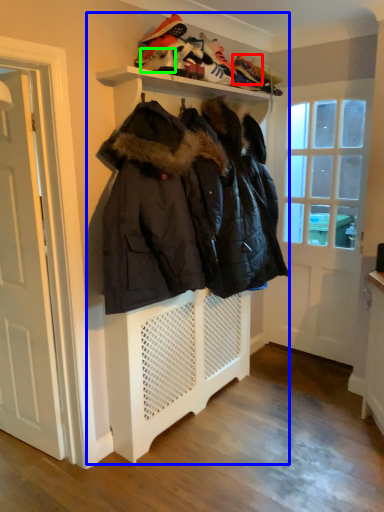
Question: Which is nearer to the shoe (highlighted by a red box)? closet (highlighted by a blue box) or shoe (highlighted by a green box).

Choices:
 (A) closet
 (B) shoe

Answer: (B)